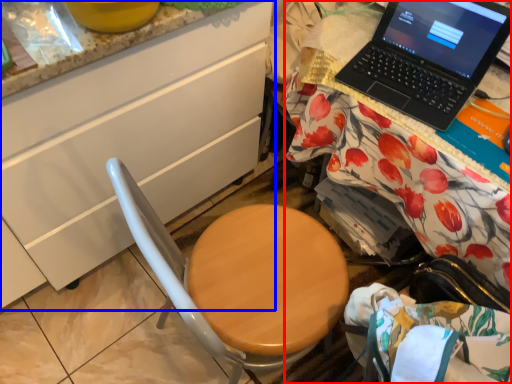
Question: Which object appears closest to the camera in this image, desk (highlighted by a red box) or cabinetry (highlighted by a blue box)?

Choices:
 (A) desk
 (B) cabinetry

Answer: (B)